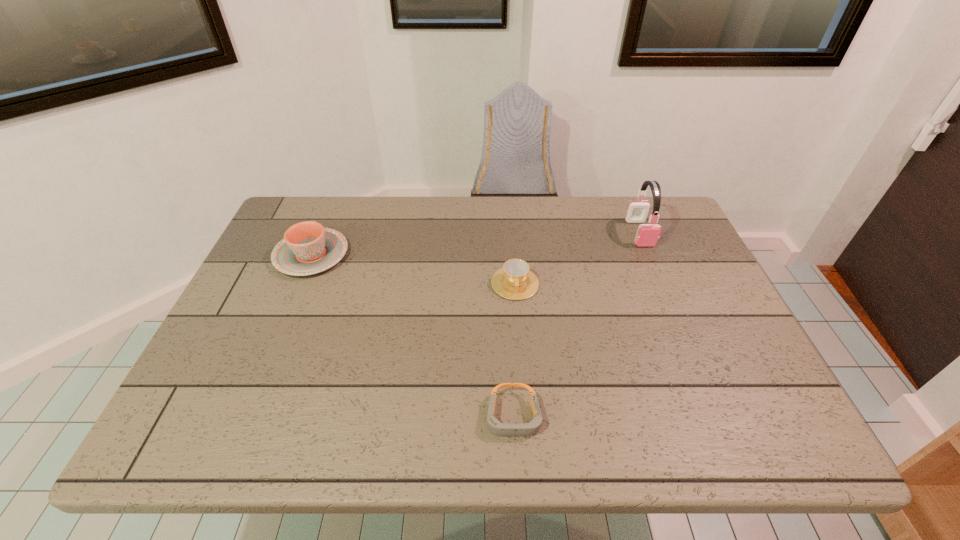
You are a GUI agent. You are given a task and a screenshot of the screen. Output one action in this format:
    pyautogui.click(x=<x>, y=<y>)
    Task: Click on the vacant point located 0.090m with the handle on the side of the third tallest object
    The height and width of the screenshot is (540, 960).
    Given the screenshot: What is the action you would take?
    pyautogui.click(x=518, y=328)

Locate an element on the screen. The width and height of the screenshot is (960, 540). earphone positioned at the far edge is located at coordinates (647, 235).

This screenshot has height=540, width=960. I want to click on chinaware that is at the far edge, so click(308, 248).

Locate an element on the screen. The height and width of the screenshot is (540, 960). object present at the near edge is located at coordinates (495, 426).

Locate an element on the screen. object present at the left edge is located at coordinates (308, 248).

The image size is (960, 540). Identify the location of object positioned at the right edge. (647, 235).

Where is `object present at the far left corner`? object present at the far left corner is located at coordinates (308, 248).

The height and width of the screenshot is (540, 960). In order to click on object that is at the far right corner in this screenshot , I will do `click(647, 235)`.

You are a GUI agent. You are given a task and a screenshot of the screen. Output one action in this format:
    pyautogui.click(x=<x>, y=<y>)
    Task: Click on the vacant space at the far edge of the desktop
    This screenshot has width=960, height=540.
    Given the screenshot: What is the action you would take?
    [461, 237]

In the image, there is a desktop. What are the coordinates of `vacant space at the near edge` in the screenshot? It's located at (306, 417).